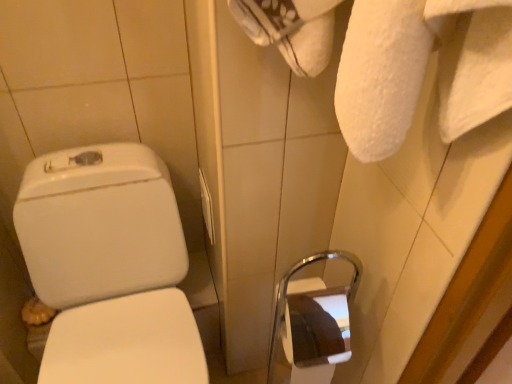
Measure the distance between white plastic towel bar at center and camera.

white plastic towel bar at center is 37.44 inches from camera.

You are a GUI agent. You are given a task and a screenshot of the screen. Output one action in this format:
    pyautogui.click(x=<x>, y=<y>)
    Task: Click on the white plastic towel bar at center
    Image resolution: width=512 pixels, height=384 pixels.
    Given the screenshot: What is the action you would take?
    tap(207, 207)

The width and height of the screenshot is (512, 384). What do you see at coordinates (207, 207) in the screenshot? I see `white plastic towel bar at center` at bounding box center [207, 207].

Where is `white glossy toilet at left`? The image size is (512, 384). white glossy toilet at left is located at coordinates (109, 267).

The image size is (512, 384). What do you see at coordinates (109, 267) in the screenshot?
I see `white glossy toilet at left` at bounding box center [109, 267].

Identify the location of white plastic towel bar at center. The image size is (512, 384). (207, 207).

Based on their positions, is white plastic towel bar at center located to the left or right of white glossy toilet at left?

In the image, white plastic towel bar at center appears on the right side of white glossy toilet at left.

Considering their positions, is white plastic towel bar at center located in front of or behind white glossy toilet at left?

In the image, white plastic towel bar at center appears behind white glossy toilet at left.

Does point (207, 204) lie behind point (150, 219)?

Yes, it is behind point (150, 219).

From the image's perspective, is white plastic towel bar at center below white glossy toilet at left?

Incorrect, from the image's perspective, white plastic towel bar at center is higher than white glossy toilet at left.

From a real-world perspective, relative to white glossy toilet at left, is white plastic towel bar at center vertically above or below?

From a real-world perspective, white plastic towel bar at center is physically above white glossy toilet at left.

Is white plastic towel bar at center wider or thinner than white glossy toilet at left?

In the image, white plastic towel bar at center appears to be more narrow than white glossy toilet at left.

Does white plastic towel bar at center have a greater height compared to white glossy toilet at left?

In fact, white plastic towel bar at center may be shorter than white glossy toilet at left.

Which of these two, white plastic towel bar at center or white glossy toilet at left, is smaller?

white plastic towel bar at center is smaller.

Is white plastic towel bar at center not within white glossy toilet at left?

Yes, white plastic towel bar at center is located beyond the bounds of white glossy toilet at left.

Are white plastic towel bar at center and white glossy toilet at left far apart?

No, white plastic towel bar at center is not far from white glossy toilet at left.

Is white plastic towel bar at center oriented towards white glossy toilet at left?

Yes, white plastic towel bar at center faces towards white glossy toilet at left.

What's the angular difference between white plastic towel bar at center and white glossy toilet at left's facing directions?

white plastic towel bar at center and white glossy toilet at left are facing 90 degrees away from each other.

How distant is white plastic towel bar at center from white glossy toilet at left?

white plastic towel bar at center and white glossy toilet at left are 10.03 inches apart from each other.

The width and height of the screenshot is (512, 384). In order to click on towel bar above the white glossy toilet at left (from the image's perspective) in this screenshot , I will do `click(207, 207)`.

Would you say white glossy toilet at left is to the left or to the right of white plastic towel bar at center in the picture?

white glossy toilet at left is positioned on white plastic towel bar at center's left side.

Consider the image. Between white glossy toilet at left and white plastic towel bar at center, which one is positioned in front?

Positioned in front is white glossy toilet at left.

Which is in front, point (41, 222) or point (200, 176)?

The point (41, 222) is closer.

From the image's perspective, which one is positioned lower, white glossy toilet at left or white plastic towel bar at center?

white glossy toilet at left appears lower in the image.

Based on the photo, from a real-world perspective, who is located lower, white glossy toilet at left or white plastic towel bar at center?

white glossy toilet at left is physically lower.

Considering the sizes of objects white glossy toilet at left and white plastic towel bar at center in the image provided, who is wider, white glossy toilet at left or white plastic towel bar at center?

Wider between the two is white glossy toilet at left.

Does white glossy toilet at left have a lesser height compared to white plastic towel bar at center?

No, white glossy toilet at left is not shorter than white plastic towel bar at center.

Which of these two, white glossy toilet at left or white plastic towel bar at center, is bigger?

white glossy toilet at left is bigger.

Is white glossy toilet at left completely or partially outside of white plastic towel bar at center?

Yes, white glossy toilet at left is outside of white plastic towel bar at center.

Are white glossy toilet at left and white plastic towel bar at center located far from each other?

white glossy toilet at left is near white plastic towel bar at center, not far away.

Is white glossy toilet at left looking in the opposite direction of white plastic towel bar at center?

No, white plastic towel bar at center is not at the back of white glossy toilet at left.

Can you tell me how much white glossy toilet at left and white plastic towel bar at center differ in facing direction?

They differ by 90 degrees in their facing directions.

At what (x,y) coordinates should I click in order to perform the action: click on towel bar lying on the right of white glossy toilet at left. Please return your answer as a coordinate pair (x, y). Looking at the image, I should click on (207, 207).

You are a GUI agent. You are given a task and a screenshot of the screen. Output one action in this format:
    pyautogui.click(x=<x>, y=<y>)
    Task: Click on the towel bar above the white glossy toilet at left (from a real-world perspective)
    This screenshot has height=384, width=512.
    Given the screenshot: What is the action you would take?
    pyautogui.click(x=207, y=207)

Locate an element on the screen. This screenshot has width=512, height=384. toilet that appears in front of the white plastic towel bar at center is located at coordinates (109, 267).